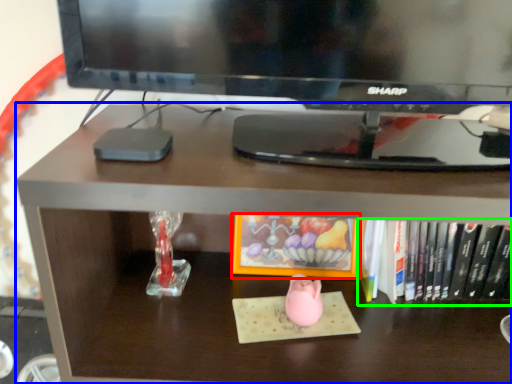
Question: Which object is positioned closest to book (highlighted by a red box)? Select from desk (highlighted by a blue box) and book (highlighted by a green box).

Choices:
 (A) desk
 (B) book

Answer: (B)